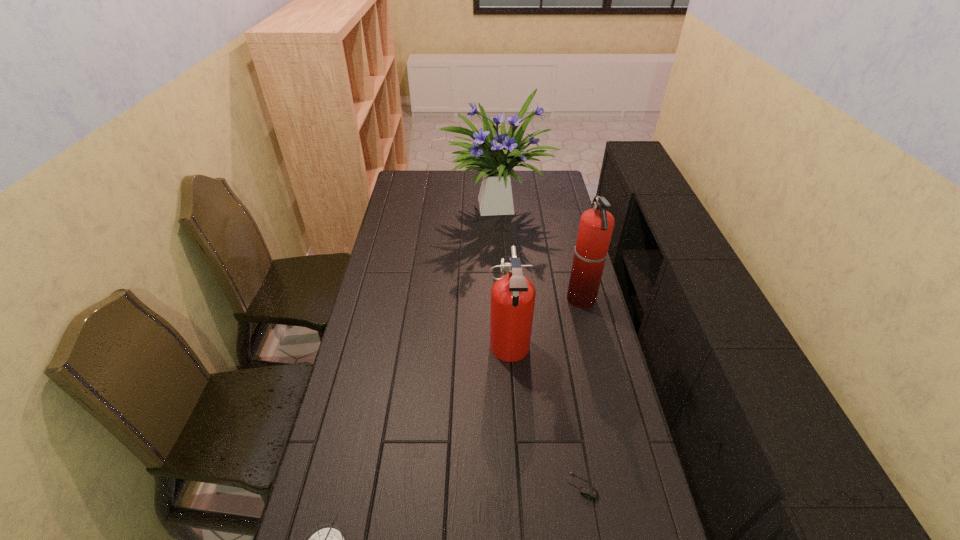
Where is `vacant space at the far right corner of the desktop`? The width and height of the screenshot is (960, 540). vacant space at the far right corner of the desktop is located at coordinates (540, 187).

You are a GUI agent. You are given a task and a screenshot of the screen. Output one action in this format:
    pyautogui.click(x=<x>, y=<y>)
    Task: Click on the empty location between the fourth farthest object and the nearer fire extinguisher
    
    Given the screenshot: What is the action you would take?
    pyautogui.click(x=545, y=419)

The image size is (960, 540). I want to click on empty space that is in between the mouse and the farthest object, so click(x=540, y=345).

Image resolution: width=960 pixels, height=540 pixels. I want to click on empty location between the third farthest object and the fourth nearest object, so click(x=545, y=326).

I want to click on unoccupied area between the right fire extinguisher and the third farthest object, so click(545, 326).

Image resolution: width=960 pixels, height=540 pixels. I want to click on free area in between the nearer fire extinguisher and the mouse, so click(545, 419).

Locate an element on the screen. This screenshot has height=540, width=960. empty space between the fourth farthest object and the farthest object is located at coordinates (540, 345).

The image size is (960, 540). Find the location of `free space between the right fire extinguisher and the flower arrangement`. free space between the right fire extinguisher and the flower arrangement is located at coordinates (540, 252).

Where is `object identified as the third closest to the shortest object`? The height and width of the screenshot is (540, 960). object identified as the third closest to the shortest object is located at coordinates (596, 225).

Locate which object ranks fourth in proximity to the right fire extinguisher. Please provide its 2D coordinates. Your answer should be formatted as a tuple, i.e. [(x, y)], where the tuple contains the x and y coordinates of a point satisfying the conditions above.

[(328, 539)]